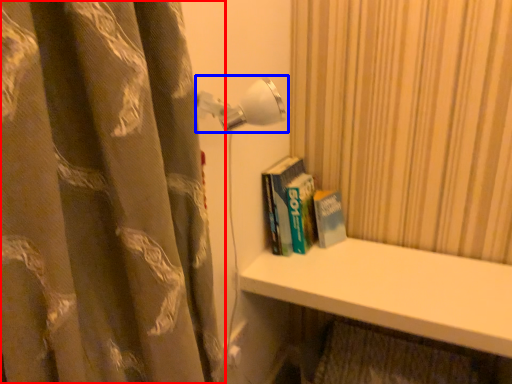
Question: Among these objects, which one is farthest to the camera, curtain (highlighted by a red box) or lamp (highlighted by a blue box)?

Choices:
 (A) curtain
 (B) lamp

Answer: (B)